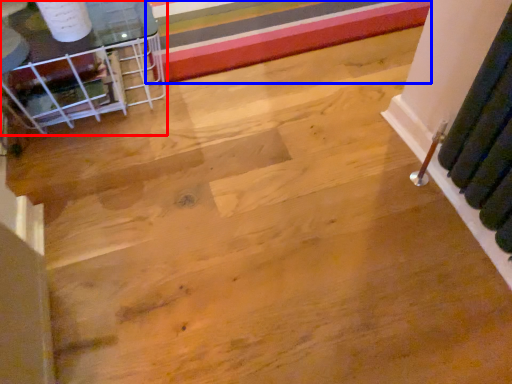
Question: Which object is closer to the camera taking this photo, furniture (highlighted by a red box) or stripe (highlighted by a blue box)?

Choices:
 (A) furniture
 (B) stripe

Answer: (A)